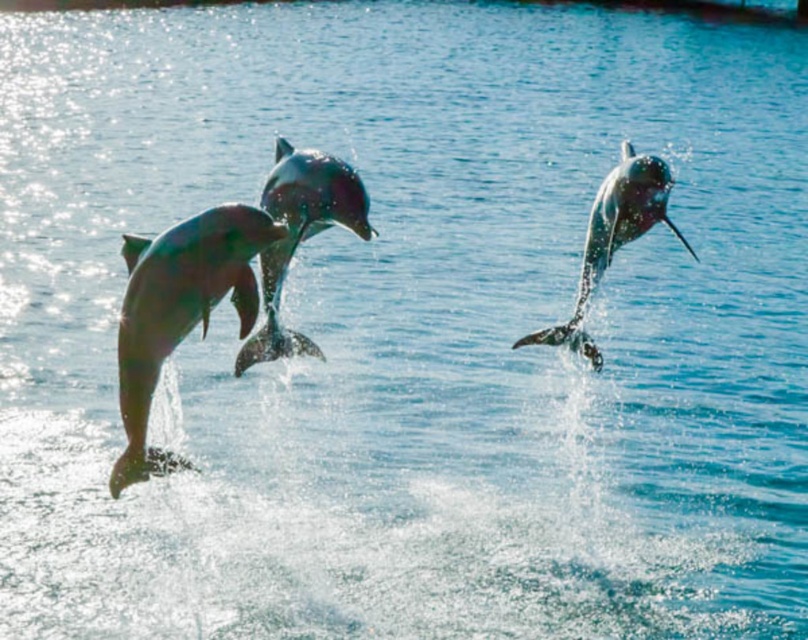
Is point (170, 268) positioned before point (284, 353)?

Yes, point (170, 268) is closer to viewer.

Can you confirm if shiny metallic dolphin at left is positioned to the left of shiny silver dolphin at center?

Yes, shiny metallic dolphin at left is to the left of shiny silver dolphin at center.

Does point (175, 260) come behind point (287, 333)?

That is False.

Identify the location of shiny metallic dolphin at left. The height and width of the screenshot is (640, 808). (179, 308).

Where is `shiny metallic dolphin at left`? The width and height of the screenshot is (808, 640). shiny metallic dolphin at left is located at coordinates (179, 308).

This screenshot has width=808, height=640. Describe the element at coordinates (179, 308) in the screenshot. I see `shiny metallic dolphin at left` at that location.

Describe the element at coordinates (179, 308) in the screenshot. I see `shiny metallic dolphin at left` at that location.

What are the coordinates of `shiny metallic dolphin at left` in the screenshot? It's located at (179, 308).

Is point (276, 326) in front of point (573, 310)?

Yes, point (276, 326) is closer to viewer.

Looking at this image, who is shorter, shiny silver dolphin at center or shiny silver dolphin at upper right?

shiny silver dolphin at upper right is shorter.

Which is behind, point (347, 221) or point (588, 342)?

Positioned behind is point (588, 342).

This screenshot has height=640, width=808. I want to click on shiny silver dolphin at center, so click(301, 236).